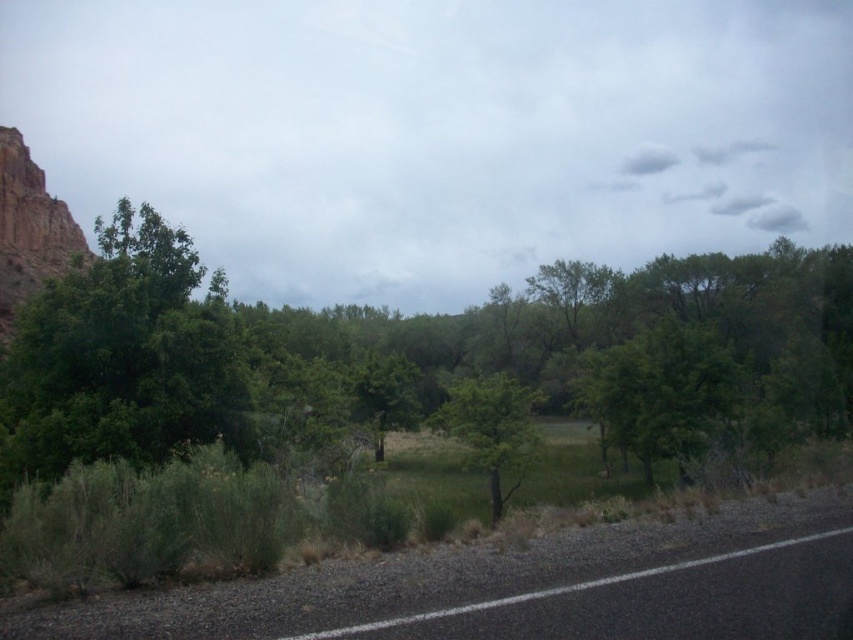
You are standing on the paved road with the white edge line and want to walk to the rock formation in the background. Which direction should you go relative to the green leafy tree at left and the green leafy tree at center?

You should walk to the right of the green leafy tree at left and to the left of the green leafy tree at center since the rock formation is in the background, and the trees are positioned with the left tree being to the left of the center tree, creating a path towards the background.